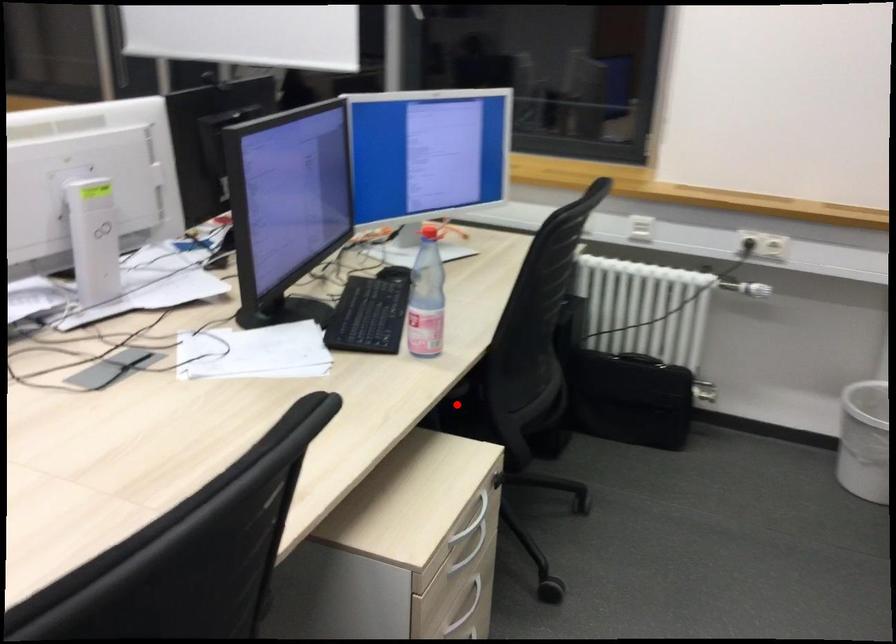
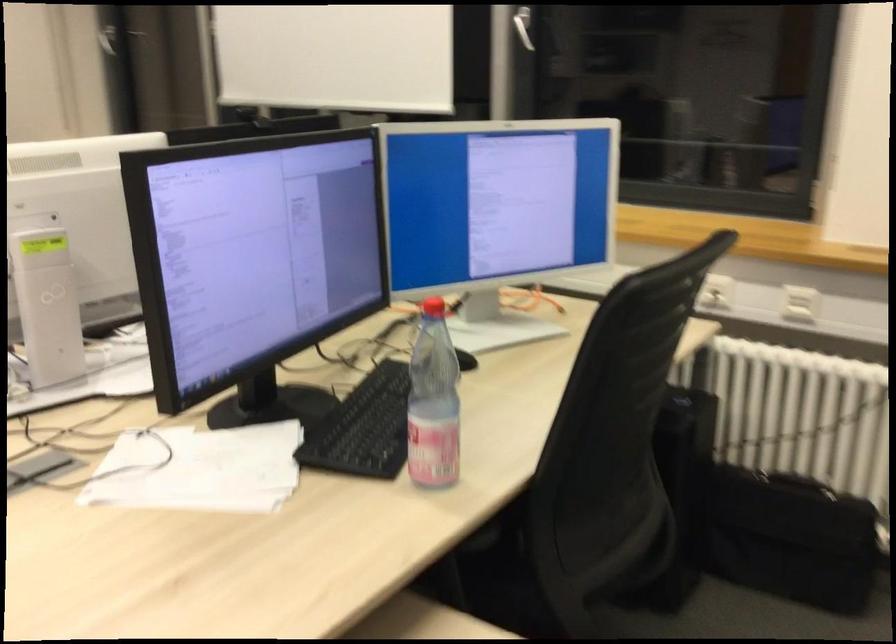
Question: A red point is marked in image1. In image2, is the corresponding 3D point closer to the camera or farther? Reply with the corresponding letter.

Choices:
 (A) The corresponding 3D point is closer.
 (B) The corresponding 3D point is farther.

Answer: (A)